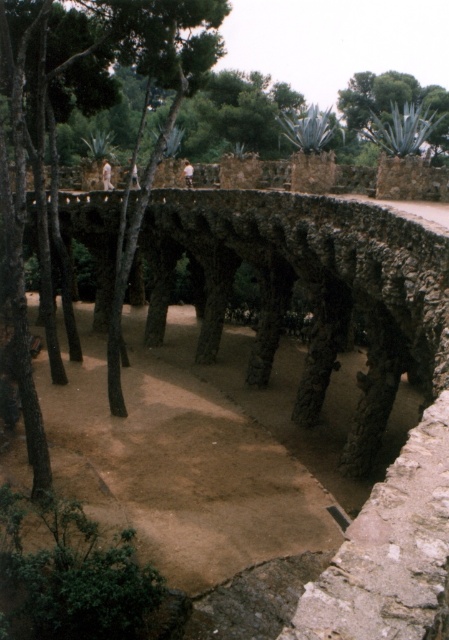
Question: Which point is closer to the camera taking this photo?

Choices:
 (A) (192, 172)
 (B) (106, 177)
 (C) (432, 317)

Answer: (C)

Question: Which object appears closest to the camera in this image?

Choices:
 (A) white matte dress at upper center
 (B) rustic stone bridge at center
 (C) white matte shirt at upper center

Answer: (B)

Question: Estimate the real-world distances between objects in this image. Which object is closer to the white matte dress at upper center?

Choices:
 (A) rustic stone bridge at center
 (B) white matte shirt at upper center

Answer: (B)

Question: Does rustic stone bridge at center appear on the right side of white matte dress at upper center?

Choices:
 (A) yes
 (B) no

Answer: (A)

Question: Is rustic stone bridge at center wider than white matte dress at upper center?

Choices:
 (A) yes
 (B) no

Answer: (A)

Question: Considering the relative positions of rustic stone bridge at center and white matte shirt at upper center in the image provided, where is rustic stone bridge at center located with respect to white matte shirt at upper center?

Choices:
 (A) above
 (B) below

Answer: (B)